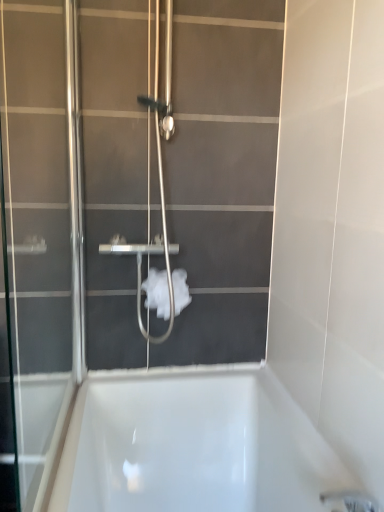
Question: Does transparent glass screen door at left have a smaller size compared to white fluffy toilet paper at center?

Choices:
 (A) yes
 (B) no

Answer: (B)

Question: Is transparent glass screen door at left wider than white fluffy toilet paper at center?

Choices:
 (A) no
 (B) yes

Answer: (A)

Question: From the image's perspective, is transparent glass screen door at left located beneath white fluffy toilet paper at center?

Choices:
 (A) no
 (B) yes

Answer: (A)

Question: From a real-world perspective, is transparent glass screen door at left below white fluffy toilet paper at center?

Choices:
 (A) yes
 (B) no

Answer: (B)

Question: Is transparent glass screen door at left far from white fluffy toilet paper at center?

Choices:
 (A) yes
 (B) no

Answer: (B)

Question: Does transparent glass screen door at left have a larger size compared to white fluffy toilet paper at center?

Choices:
 (A) yes
 (B) no

Answer: (A)

Question: From the image's perspective, is white fluffy toilet paper at center below transparent glass screen door at left?

Choices:
 (A) no
 (B) yes

Answer: (B)

Question: From a real-world perspective, is white fluffy toilet paper at center positioned under transparent glass screen door at left based on gravity?

Choices:
 (A) yes
 (B) no

Answer: (A)

Question: From the image's perspective, is white fluffy toilet paper at center on transparent glass screen door at left?

Choices:
 (A) yes
 (B) no

Answer: (B)

Question: Can you confirm if white fluffy toilet paper at center is positioned to the right of transparent glass screen door at left?

Choices:
 (A) no
 (B) yes

Answer: (B)

Question: Is white fluffy toilet paper at center wider than transparent glass screen door at left?

Choices:
 (A) yes
 (B) no

Answer: (A)

Question: Is white fluffy toilet paper at center at the left side of transparent glass screen door at left?

Choices:
 (A) no
 (B) yes

Answer: (A)

Question: From their relative heights in the image, would you say white fluffy toilet paper at center is taller or shorter than transparent glass screen door at left?

Choices:
 (A) tall
 (B) short

Answer: (B)